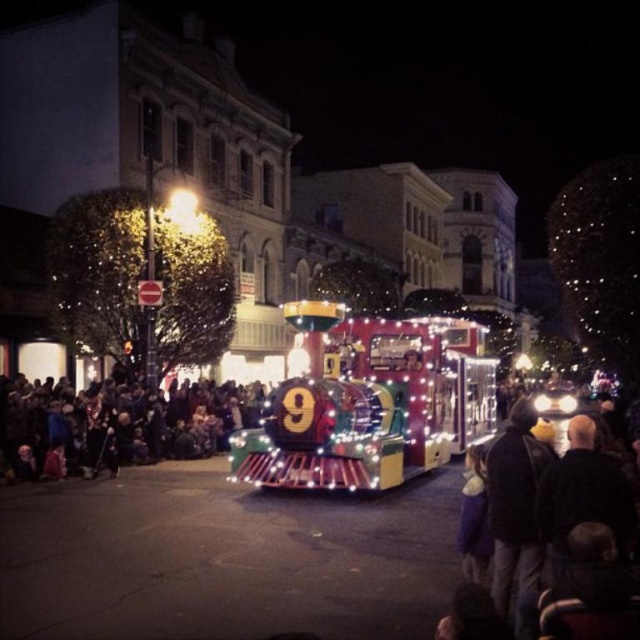
Question: Is dark brown hair at center wider than dark gray hoodie at center?

Choices:
 (A) yes
 (B) no

Answer: (A)

Question: From the image, what is the correct spatial relationship of dark brown hair at center in relation to dark gray hoodie at center?

Choices:
 (A) above
 (B) below

Answer: (A)

Question: Which point is farther to the camera?

Choices:
 (A) dark blue jacket at center
 (B) dark brown hair at center
 (C) dark gray hoodie at center

Answer: (B)

Question: Which of these objects is positioned closest to the dark gray hoodie at center?

Choices:
 (A) dark brown hair at center
 (B) dark blue jacket at center

Answer: (B)

Question: Among these objects, which one is nearest to the camera?

Choices:
 (A) dark gray hoodie at center
 (B) dark blue jacket at center
 (C) dark brown hair at center

Answer: (B)

Question: Is dark brown hair at center positioned in front of dark blue jacket at center?

Choices:
 (A) no
 (B) yes

Answer: (A)